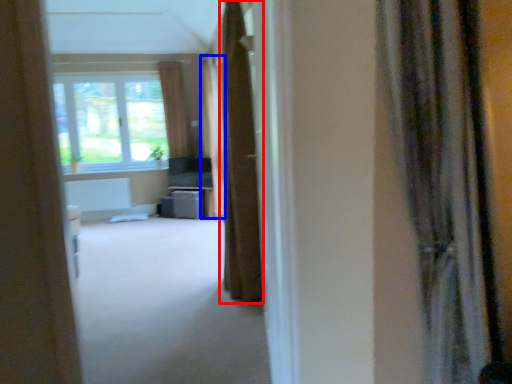
Question: Which of the following is the farthest to the observer, curtain (highlighted by a red box) or curtain (highlighted by a blue box)?

Choices:
 (A) curtain
 (B) curtain

Answer: (B)